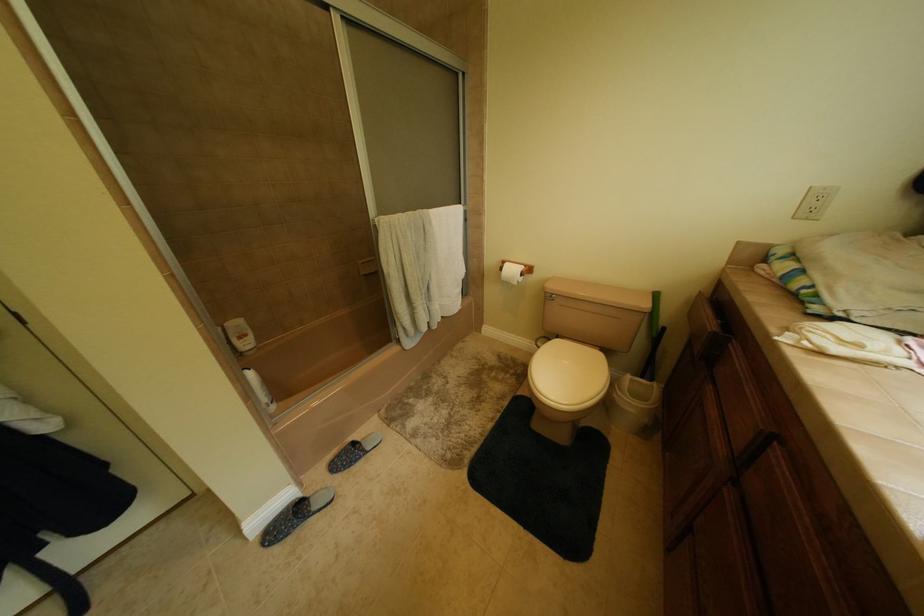
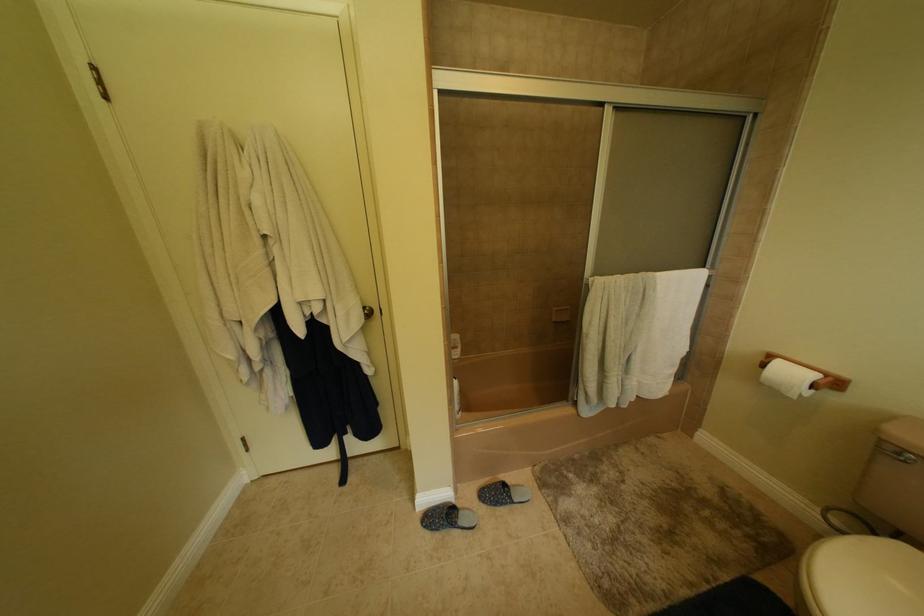
Question: The camera is either moving clockwise (left) or counter-clockwise (right) around the object. The first image is from the beginning of the video and the second image is from the end. Is the camera moving left or right when shooting the video?

Choices:
 (A) Left
 (B) Right

Answer: (B)